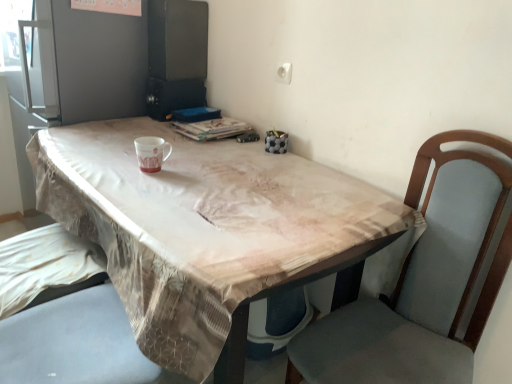
In order to click on free location to the right of matte ceramic mug at center in this screenshot , I will do (196, 183).